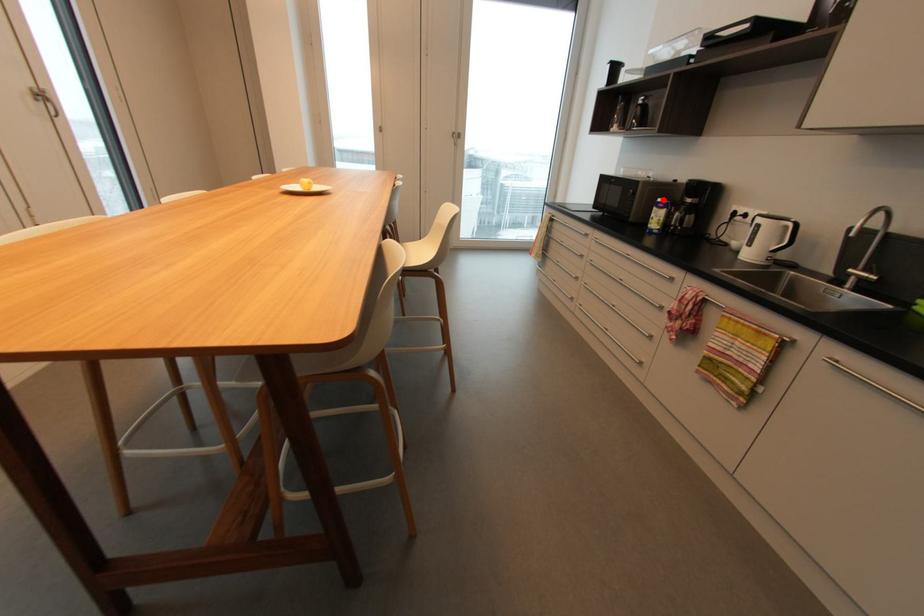
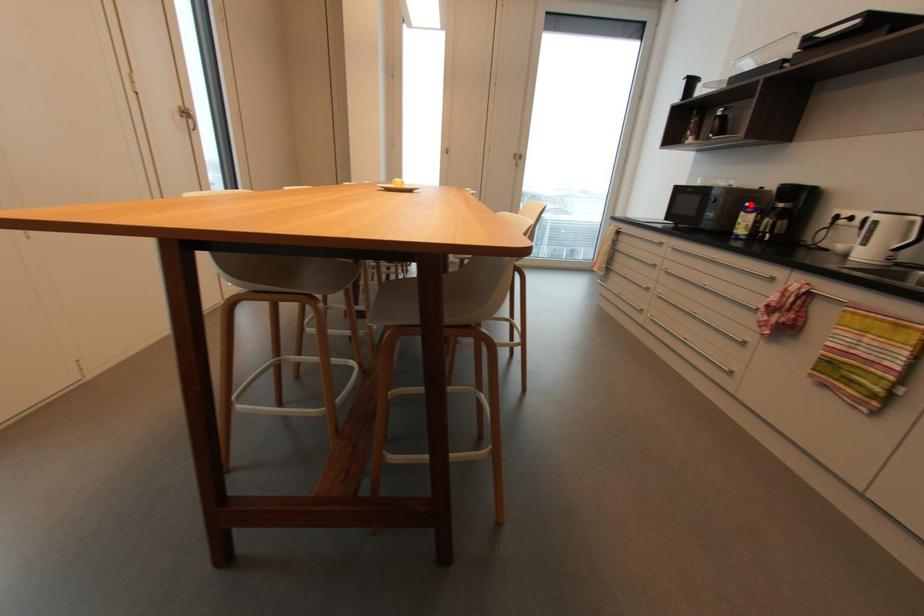
I am providing you with two images of the same scene from different viewpoints. A red point is marked on the first image and another point is marked on the second image. Do the highlighted points in image1 and image2 indicate the same real-world spot?

Yes